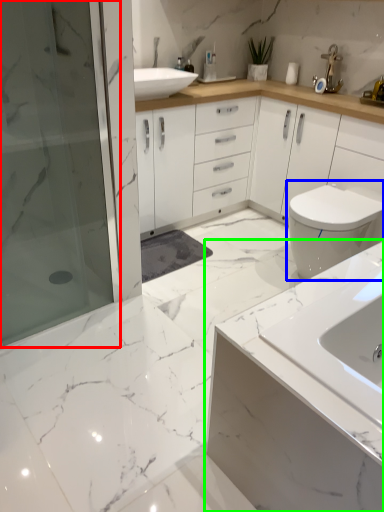
Question: Considering the real-world distances, which object is farthest from shower door (highlighted by a red box)? toilet (highlighted by a blue box) or bathroom cabinet (highlighted by a green box)?

Choices:
 (A) toilet
 (B) bathroom cabinet

Answer: (B)